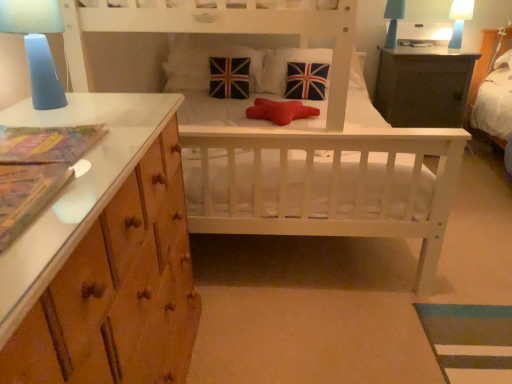
Question: Considering the relative positions of white wooden crib at center and velvet union jack pillow at center, which is the 2th pillow in left-to-right order, in the image provided, is white wooden crib at center to the left or to the right of velvet union jack pillow at center, which is the 2th pillow in left-to-right order,?

Choices:
 (A) left
 (B) right

Answer: (B)

Question: Is point (389, 172) positioned closer to the camera than point (209, 94)?

Choices:
 (A) closer
 (B) farther

Answer: (A)

Question: Considering the real-world distances, which object is closest to the velvet union jack pillow at center, which is counted as the third pillow, starting from the right?

Choices:
 (A) blue frosted glass lamp at upper left, the 3th bedside lamp in the back-to-front sequence
 (B) blue matte lampshade at upper right, marked as the 2th bedside lamp in a right-to-left arrangement
 (C) dark gray wooden table at upper right
 (D) velvet union jack pillow at center, which appears as the 1th pillow when viewed from the left
 (E) red felt pillow at center, the 2th pillow from the right

Answer: (D)

Question: Which is nearer to the blue matte lampshade at upper right, marked as the 2th bedside lamp in a right-to-left arrangement?

Choices:
 (A) blue frosted glass lamp at upper left, the third bedside lamp positioned from the top
 (B) dark gray wooden table at upper right
 (C) velvet union jack pillow at center, which appears as the 1th pillow when viewed from the left
 (D) union jack fabric pillow at center, which appears as the 4th pillow when viewed from the left
 (E) velvet union jack pillow at center, which is the 2th pillow in left-to-right order

Answer: (B)